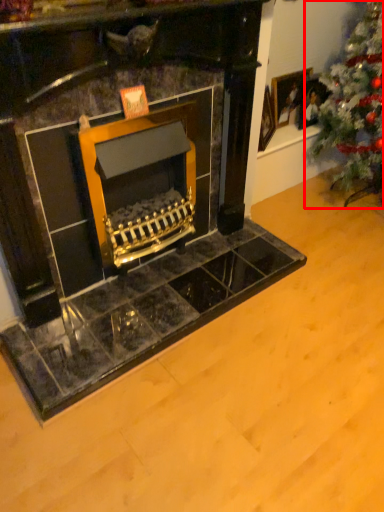
Question: Considering the relative positions of christmas tree (annotated by the red box) and picture frame in the image provided, where is christmas tree (annotated by the red box) located with respect to the staircase?

Choices:
 (A) left
 (B) right

Answer: (B)